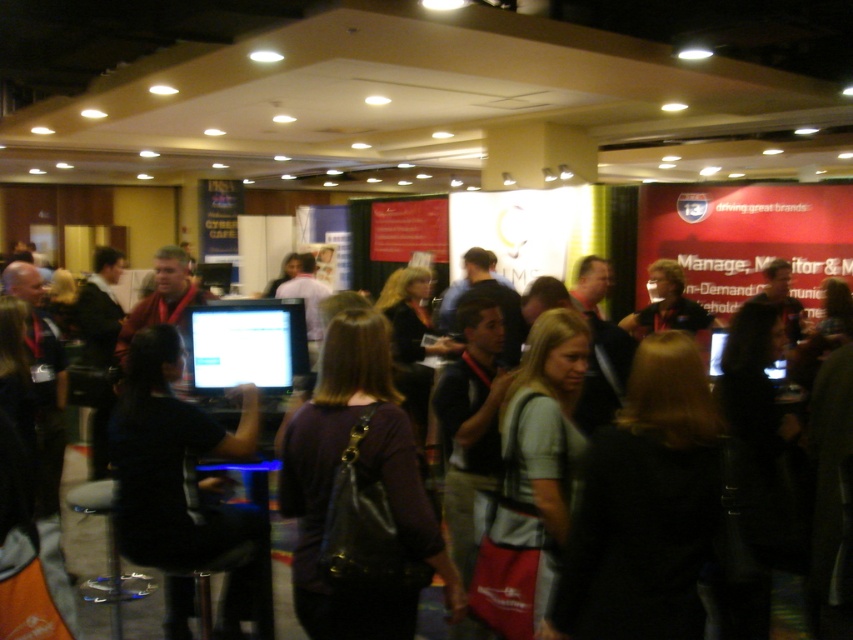
You are an event organizer trying to set up a photo backdrop for a group photo. You need to ensure that both the dark purple fabric shirt at center and the black matte computer at center are fully visible in the frame. Which object should be moved closer to the camera to avoid being cut off if they are currently positioned at the edge of the frame?

The dark purple fabric shirt at center should be moved closer to the camera because it might be wider than the black matte computer at center, making it more likely to be cut off if positioned at the edge.